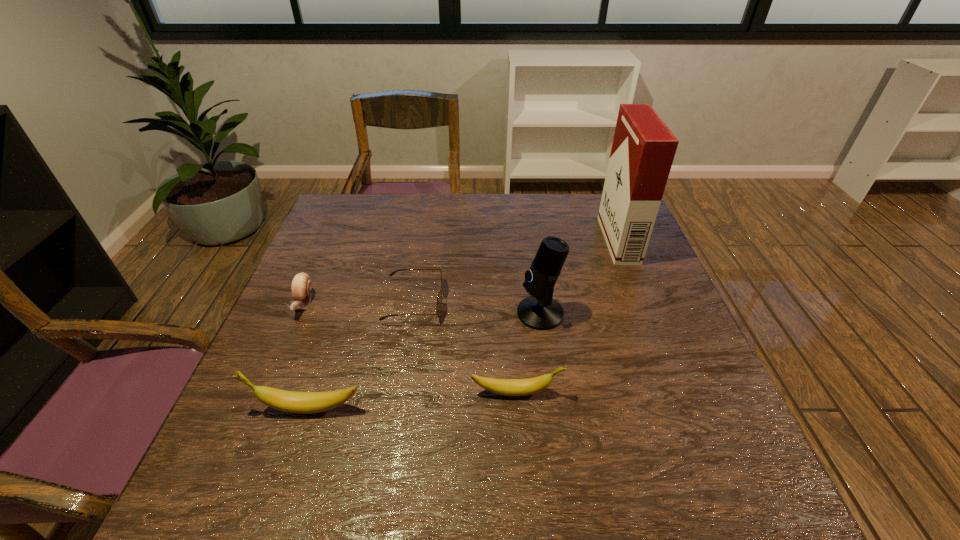
This screenshot has width=960, height=540. I want to click on free region located on the front-facing side of the farthest object, so click(480, 240).

Find the location of a particular element. This screenshot has width=960, height=540. vacant space situated 0.210m on the front-facing side of the farthest object is located at coordinates (535, 240).

The image size is (960, 540). What are the coordinates of `vacant space positioned 0.380m on the front-facing side of the farthest object` in the screenshot? It's located at click(x=477, y=240).

The width and height of the screenshot is (960, 540). I want to click on vacant space situated 0.320m on the lenses of the sunglasses, so click(571, 301).

Image resolution: width=960 pixels, height=540 pixels. What are the coordinates of `vacant point located on the stand of the fifth shortest object` in the screenshot? It's located at (476, 313).

The height and width of the screenshot is (540, 960). What are the coordinates of `free space located on the stand of the fifth shortest object` in the screenshot? It's located at click(x=398, y=313).

The width and height of the screenshot is (960, 540). Find the location of `vacant area located on the stand of the fifth shortest object`. vacant area located on the stand of the fifth shortest object is located at coordinates (370, 313).

The image size is (960, 540). I want to click on free spot located on the front-facing side of the escargot, so click(x=269, y=383).

Locate an element on the screen. object that is positioned at the far edge is located at coordinates (643, 149).

This screenshot has width=960, height=540. Find the location of `object that is at the near edge`. object that is at the near edge is located at coordinates (288, 401).